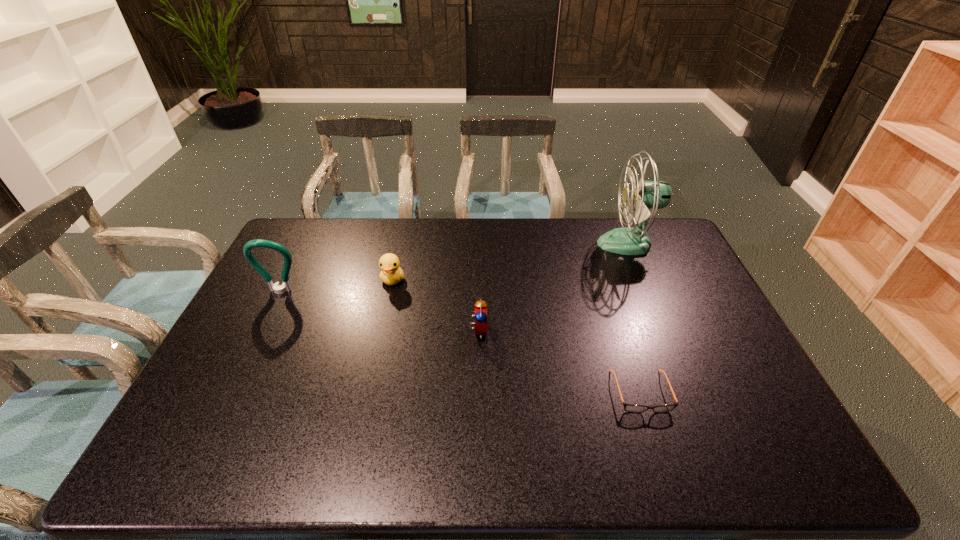
You are a GUI agent. You are given a task and a screenshot of the screen. Output one action in this format:
    pyautogui.click(x=<x>, y=<y>)
    Task: Click on the vacant space that's between the duck and the fan
    The height and width of the screenshot is (540, 960).
    Given the screenshot: What is the action you would take?
    pyautogui.click(x=511, y=262)

Image resolution: width=960 pixels, height=540 pixels. In order to click on free space between the second tallest object and the second nearest object in this screenshot , I will do `click(379, 311)`.

Find the location of `free space between the duck and the fan`. free space between the duck and the fan is located at coordinates (511, 262).

This screenshot has height=540, width=960. I want to click on free space between the farthest object and the alarm clock, so click(553, 287).

This screenshot has width=960, height=540. Identify the location of free space that is in between the shortest object and the bottle opener. (461, 342).

Identify the location of free space between the shortest object and the bottle opener. The height and width of the screenshot is (540, 960). (461, 342).

Identify which object is the third closest to the fan. Please provide its 2D coordinates. Your answer should be formatted as a tuple, i.e. [(x, y)], where the tuple contains the x and y coordinates of a point satisfying the conditions above.

[(391, 274)]

The image size is (960, 540). I want to click on object that is the fourth closest to the duck, so click(647, 195).

This screenshot has height=540, width=960. What are the coordinates of `vacant space that satisfies the following two spatial constraints: 1. in front of the farthest object, directing airflow; 2. on the front-facing side of the shortest object` in the screenshot? It's located at (690, 392).

The height and width of the screenshot is (540, 960). What are the coordinates of `free spot that satisfies the following two spatial constraints: 1. in front of the farthest object, directing airflow; 2. on the face of the duck` in the screenshot? It's located at (643, 280).